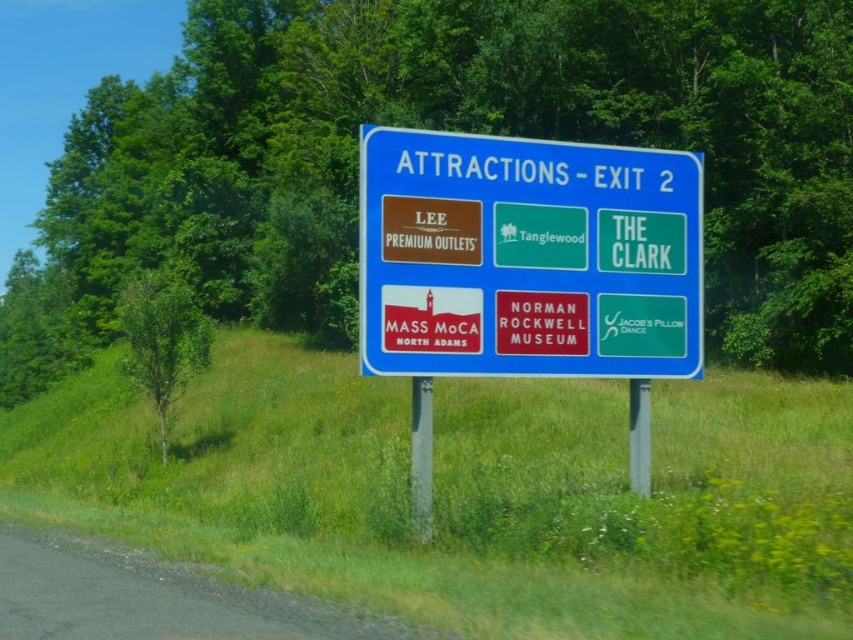
You are standing at the roadside and see the blue plastic sign at center. According to the coordinates given, where exactly is the blue plastic sign located?

The blue plastic sign at center is located at point coordinates of 0.403 on the x axis and 0.619 on the y axis.

You are standing in front of a signboard at Exit 2. You notice a blue plastic sign at center and a metallic gray pole at center. Which object is wider from your perspective?

The blue plastic sign at center is wider than the metallic gray pole at center according to the description.

You are standing in front of the roadside signboard and notice the blue plastic sign at center and the metallic gray pole at center. Which object is taller?

The blue plastic sign at center is much taller than the metallic gray pole at center.